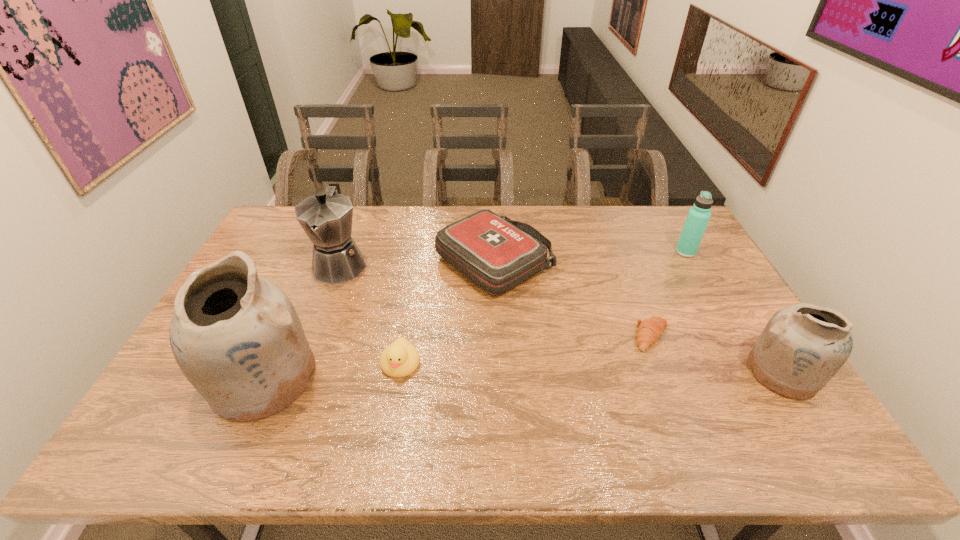
Where is `vacant space in between the crescent roll and the sixth shortest object`? vacant space in between the crescent roll and the sixth shortest object is located at coordinates (496, 300).

The height and width of the screenshot is (540, 960). In order to click on vacant area that lies between the shorter pottery and the third object from left to right in this screenshot , I will do `click(591, 368)`.

Find the location of a particular element. free spot between the fifth object from left to right and the third shortest object is located at coordinates (573, 300).

You are a GUI agent. You are given a task and a screenshot of the screen. Output one action in this format:
    pyautogui.click(x=<x>, y=<y>)
    Task: Click on the free spot between the thermos bottle and the left pottery
    This screenshot has width=960, height=540.
    Given the screenshot: What is the action you would take?
    pyautogui.click(x=474, y=315)

Where is `vacant point located between the taller pottery and the thermos bottle`? Image resolution: width=960 pixels, height=540 pixels. vacant point located between the taller pottery and the thermos bottle is located at coordinates (474, 315).

Where is `vacant area that lies between the thermos bottle and the sixth tallest object`? This screenshot has height=540, width=960. vacant area that lies between the thermos bottle and the sixth tallest object is located at coordinates (543, 308).

Image resolution: width=960 pixels, height=540 pixels. Find the location of `empty space that is in between the coffeepot and the right pottery`. empty space that is in between the coffeepot and the right pottery is located at coordinates (562, 318).

Image resolution: width=960 pixels, height=540 pixels. I want to click on unoccupied position between the thermos bottle and the taller pottery, so click(474, 315).

I want to click on vacant space in between the third shortest object and the left pottery, so click(379, 321).

Choose which object is the third nearest neighbor to the thermos bottle. Please provide its 2D coordinates. Your answer should be formatted as a tuple, i.e. [(x, y)], where the tuple contains the x and y coordinates of a point satisfying the conditions above.

[(496, 254)]